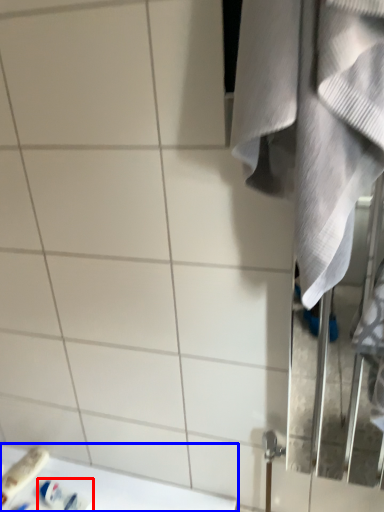
Question: Which object is closer to the camera taking this photo, toiletry (highlighted by a red box) or counter top (highlighted by a blue box)?

Choices:
 (A) toiletry
 (B) counter top

Answer: (B)